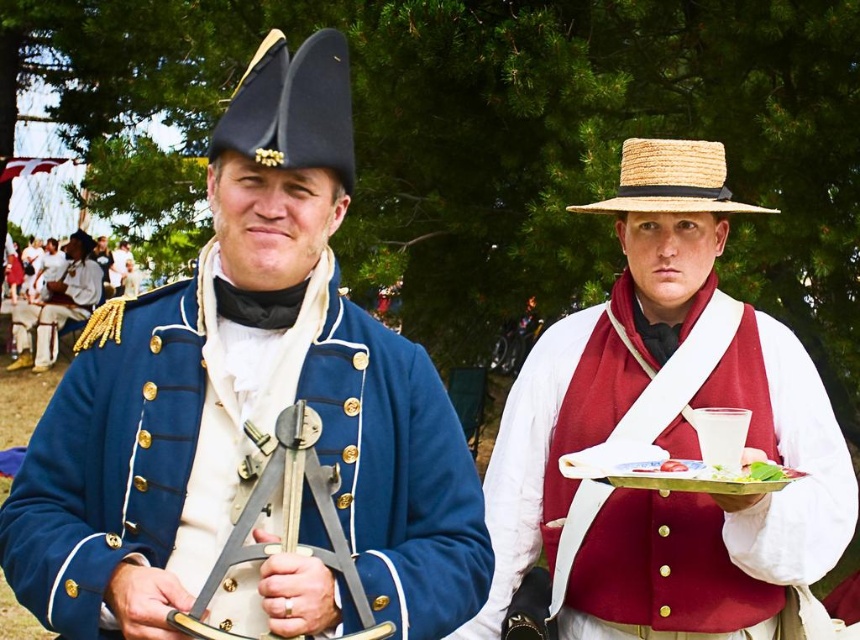
Question: Can you confirm if black felt tricorn hat at upper center is smaller than matte black tricorn hat at upper left?

Choices:
 (A) no
 (B) yes

Answer: (A)

Question: Which point appears farthest from the camera in this image?

Choices:
 (A) (659, 209)
 (B) (292, 76)

Answer: (A)

Question: Which object is the farthest from the black felt tricorn hat at upper center?

Choices:
 (A) strawmaterial/texturehat at upper right
 (B) white paper plate at center
 (C) matte black tricorn hat at upper left
 (D) white cotton shirt at left

Answer: (C)

Question: Is blue woolen coat at center positioned behind white cotton shirt at left?

Choices:
 (A) yes
 (B) no

Answer: (B)

Question: Which is farther from the matte black tricorn hat at upper left?

Choices:
 (A) matte straw hat at center
 (B) black felt tricorn hat at upper center
 (C) white cotton shirt at left
 (D) strawmaterial/texturehat at upper right

Answer: (B)

Question: Is matte straw hat at center positioned in front of matte black tricorn hat at upper left?

Choices:
 (A) no
 (B) yes

Answer: (B)